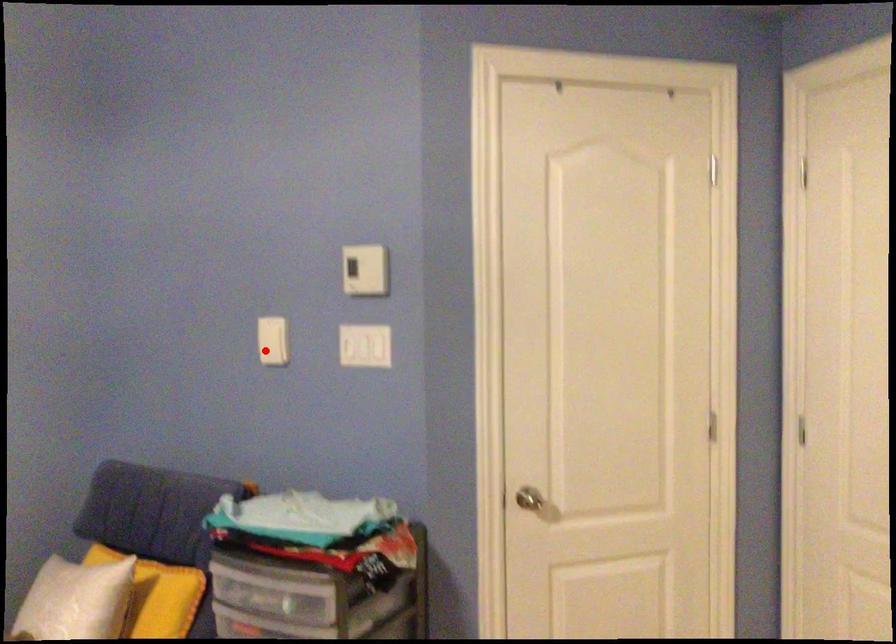
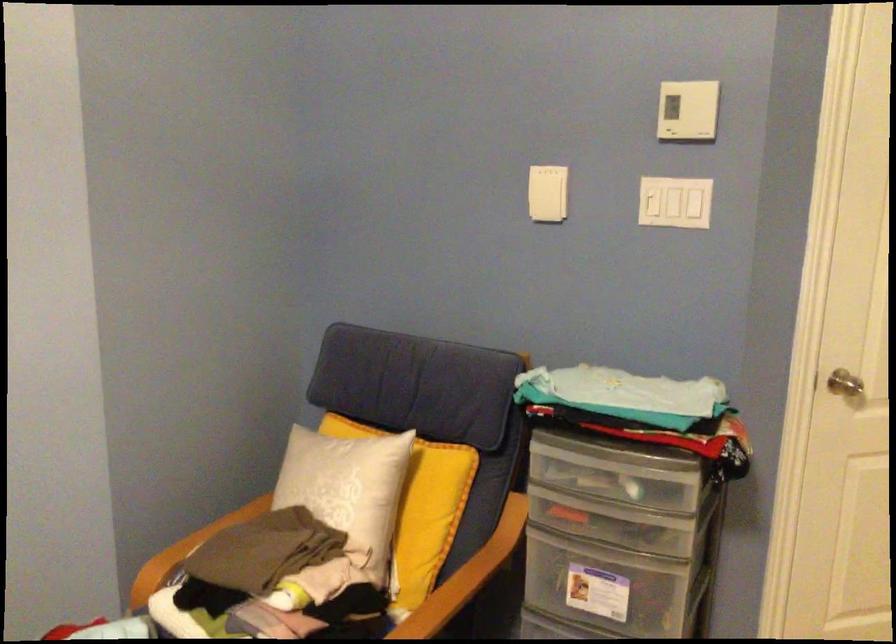
Where in the second image is the point corresponding to the highlighted location from the first image?

(543, 201)